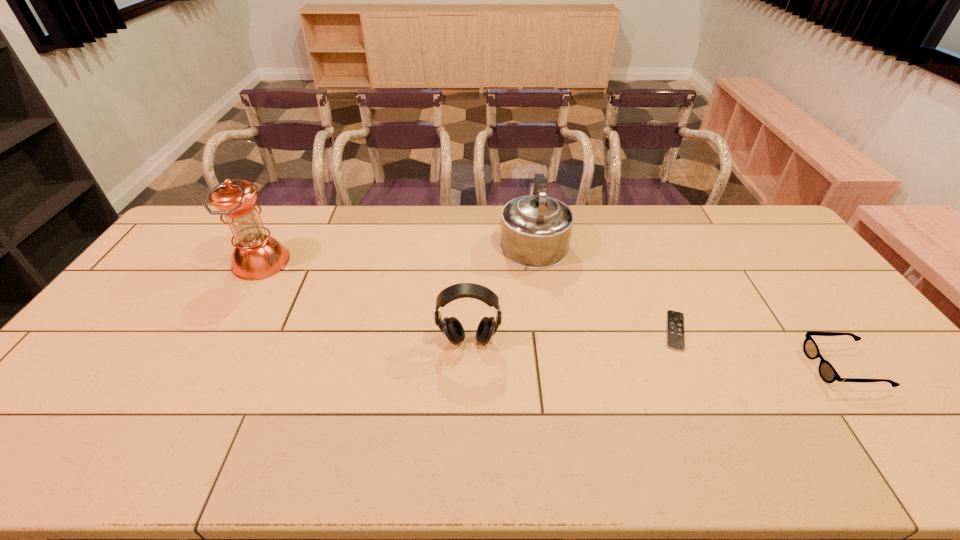
Locate an element on the screen. The width and height of the screenshot is (960, 540). vacant area between the second shortest object and the shortest object is located at coordinates [759, 349].

This screenshot has height=540, width=960. I want to click on vacant area that lies between the fourth object from right to left and the shortest object, so click(572, 336).

Locate which object is the third closest to the shortest object. Please provide its 2D coordinates. Your answer should be formatted as a tuple, i.e. [(x, y)], where the tuple contains the x and y coordinates of a point satisfying the conditions above.

[(451, 327)]

Find the location of a particular element. object that ranks as the closest to the oil lamp is located at coordinates (451, 327).